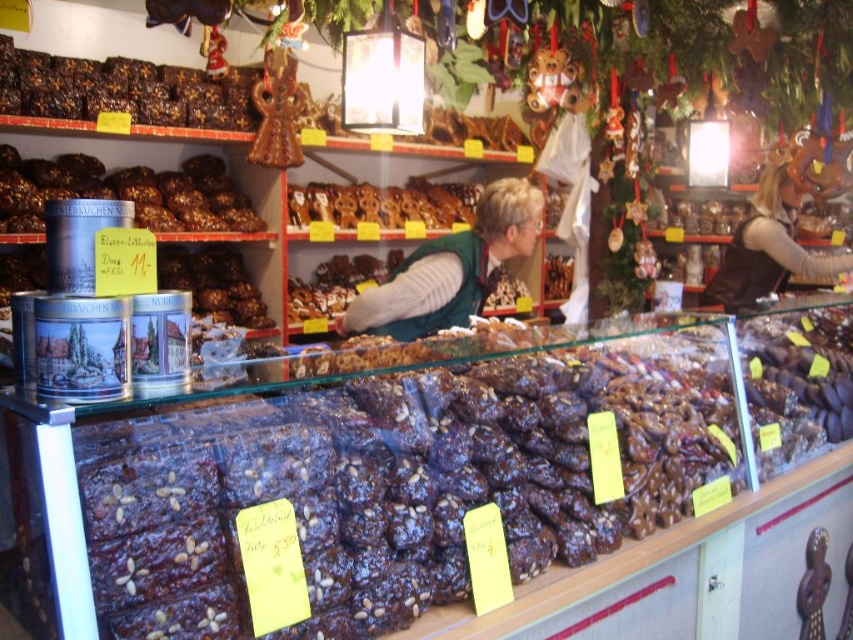
You are a customer in a bakery and want to place an order for both the dark chocolate cake at upper left and the brown glazed gingerbread at center. The cashier is located behind the counter, which is 40 inches away from the display case. Can you reach both items without moving more than 40 inches from the display case?

The dark chocolate cake at upper left is 38.85 inches from the brown glazed gingerbread at center. Since the cashier is 40 inches away from the display case, you can reach both items without exceeding the 40 inch limit because the distance between them is within the allowed range.

You are a customer in the bakery and want to buy the brown glazed gingerbread at center. The salesperson is wearing the green fabric vest at center. Where should you look to find the price of the gingerbread?

The price of the brown glazed gingerbread at center is likely displayed on the yellow price tags located below the item, near the green fabric vest at center.

You are a customer in the bakery and want to buy both the dark chocolate cake at upper left and the green fabric vest at center. However, you have a small car trunk. Considering their sizes, which item might be more challenging to fit in your trunk?

The dark chocolate cake at upper left has a larger size compared to the green fabric vest at center, so it might be more challenging to fit in your trunk.